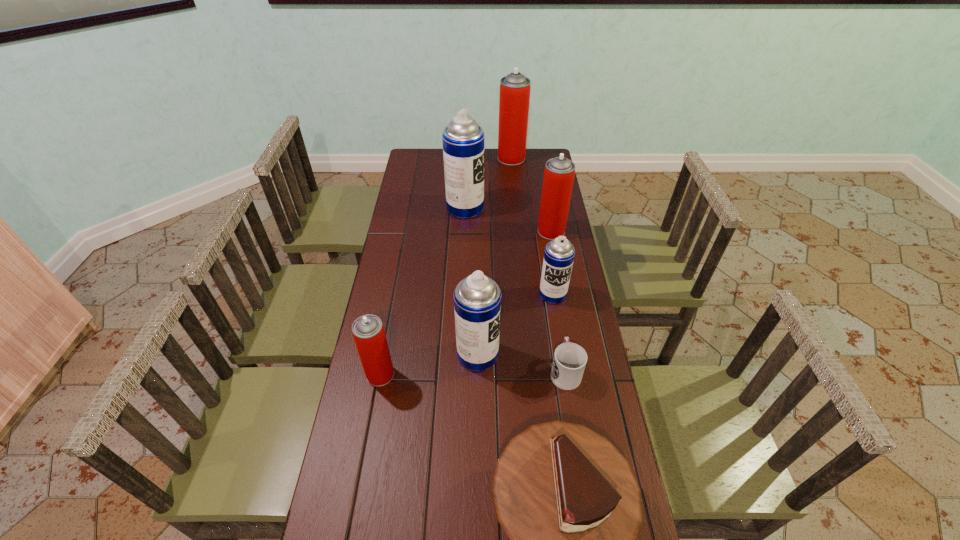
You are a GUI agent. You are given a task and a screenshot of the screen. Output one action in this format:
    pyautogui.click(x=<x>, y=<y>)
    Task: Click on the biggest blue aerosol can
    This screenshot has width=960, height=540.
    Given the screenshot: What is the action you would take?
    pyautogui.click(x=463, y=139)

At what (x,y) coordinates should I click in order to perform the action: click on the fifth nearest aerosol can. Please return your answer as a coordinate pair (x, y). Looking at the image, I should click on (463, 139).

Identify the location of the farthest aerosol can. (514, 98).

Where is `the farthest object`? Image resolution: width=960 pixels, height=540 pixels. the farthest object is located at coordinates (514, 98).

Locate an element on the screen. the sixth nearest object is located at coordinates (559, 172).

Image resolution: width=960 pixels, height=540 pixels. I want to click on the third farthest aerosol can, so click(x=559, y=172).

The width and height of the screenshot is (960, 540). I want to click on the nearest blue aerosol can, so click(x=477, y=298).

Image resolution: width=960 pixels, height=540 pixels. I want to click on the nearest red aerosol can, so click(x=368, y=332).

The image size is (960, 540). I want to click on the leftmost aerosol can, so click(x=368, y=332).

Identify the location of the smallest blue aerosol can. This screenshot has height=540, width=960. (559, 253).